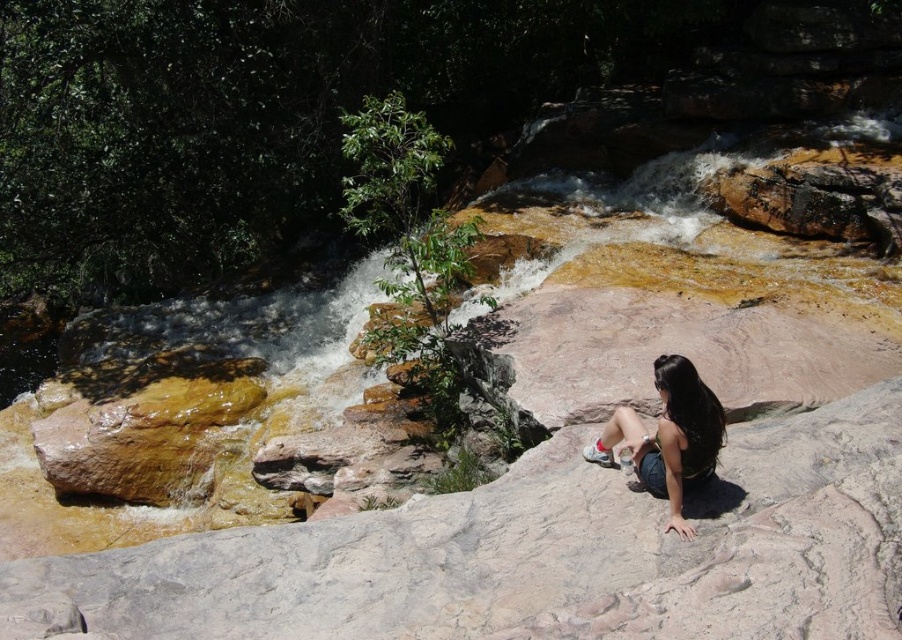
You are standing at the point labeled point [514,577] and want to move towards point [669,385]. Is the path between them going away from or towards the viewer?

The path between point [514,577] and point [669,385] is going away from the viewer because point [514,577] is closer to the viewer than point [669,385].

You are a photographer aiming to capture the smooth gray rock at center and the matte black hair at center in the same frame. Based on their sizes, which object should you focus on first to ensure both are in focus?

The smooth gray rock at center is taller than matte black hair at center, so focusing on the smooth gray rock at center first would ensure both are in focus since it is larger and closer to the camera.